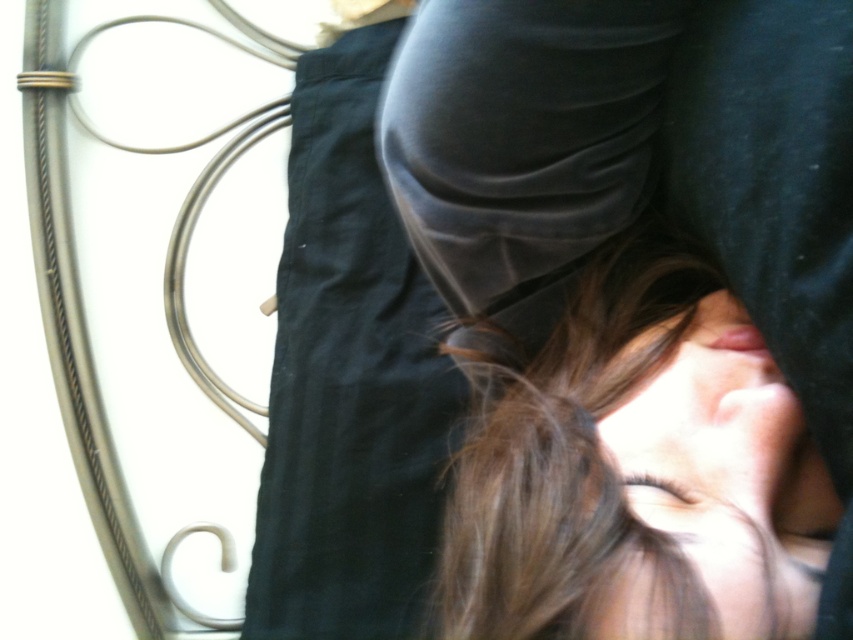
You are a photographer trying to capture a portrait of the person in the image. You notice the matte black face at center and the smooth black fabric at center. Which object is closer to the camera?

The smooth black fabric at center is closer to the camera than the matte black face at center because the matte black face at center is behind the smooth black fabric at center.

You are a photographer adjusting lighting for a portrait. You notice the smooth black fabric at center and the brown matte hair at center. Which object will require more space in your camera frame due to its size?

The brown matte hair at center requires more space in the camera frame because it is larger than the smooth black fabric at center.